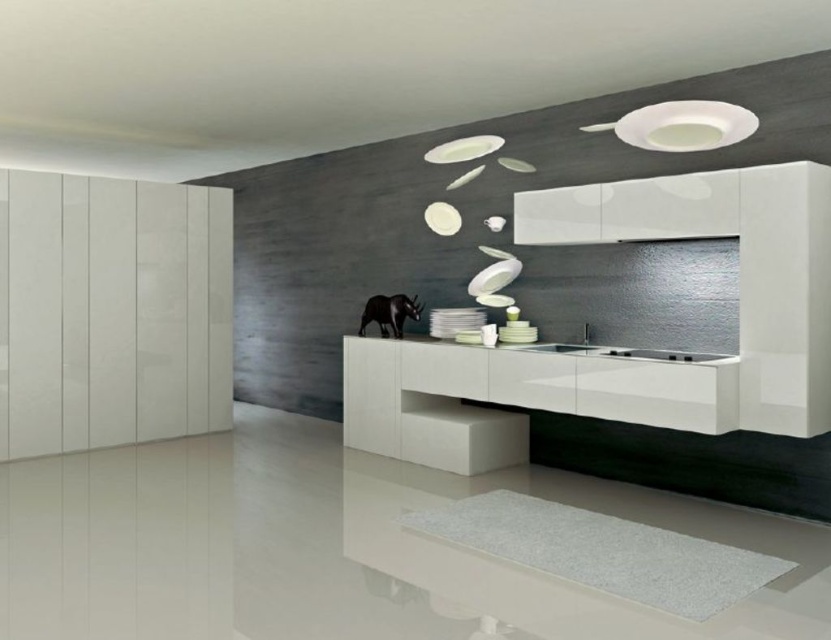
Question: Which object is closer to the camera taking this photo?

Choices:
 (A) glossy white vanity at center
 (B) white matte stool at center

Answer: (A)

Question: Can you confirm if glossy white vanity at center is smaller than white glossy sink at center?

Choices:
 (A) yes
 (B) no

Answer: (B)

Question: Considering the relative positions of glossy white vanity at center and white matte stool at center in the image provided, where is glossy white vanity at center located with respect to white matte stool at center?

Choices:
 (A) right
 (B) left

Answer: (A)

Question: Which of the following is the closest to the observer?

Choices:
 (A) glossy white vanity at center
 (B) white glossy sink at center

Answer: (A)

Question: Considering the relative positions of glossy white vanity at center and white glossy sink at center in the image provided, where is glossy white vanity at center located with respect to white glossy sink at center?

Choices:
 (A) above
 (B) below

Answer: (B)

Question: Which object appears closest to the camera in this image?

Choices:
 (A) glossy white vanity at center
 (B) white glossy sink at center

Answer: (A)